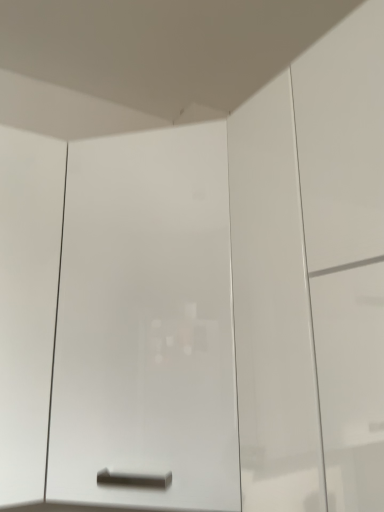
Where is `transparent glossy glass door at center`? transparent glossy glass door at center is located at coordinates (146, 322).

Describe the element at coordinates (146, 322) in the screenshot. Image resolution: width=384 pixels, height=512 pixels. I see `transparent glossy glass door at center` at that location.

What is the approximate height of transparent glossy glass door at center?

31.54 inches.

Locate an element on the screen. Image resolution: width=384 pixels, height=512 pixels. transparent glossy glass door at center is located at coordinates (146, 322).